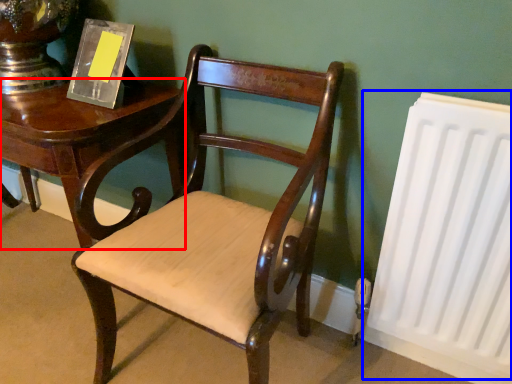
Question: Which object is closer to the camera taking this photo, table (highlighted by a red box) or radiator (highlighted by a blue box)?

Choices:
 (A) table
 (B) radiator

Answer: (B)